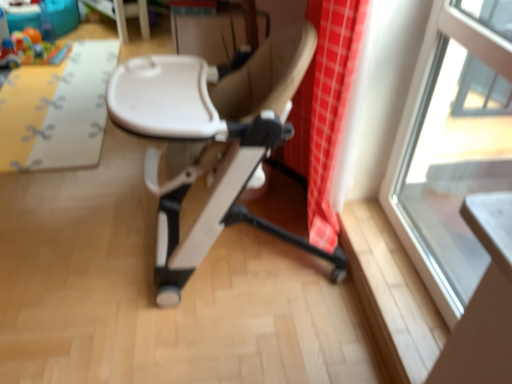
Locate an element on the screen. The height and width of the screenshot is (384, 512). vacant position to the left of transparent glass window at upper right is located at coordinates (381, 257).